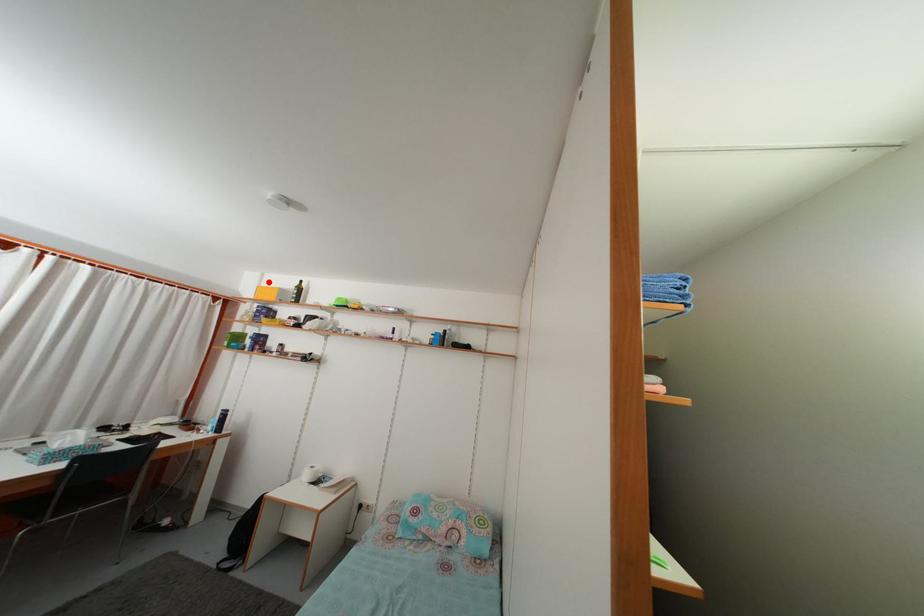
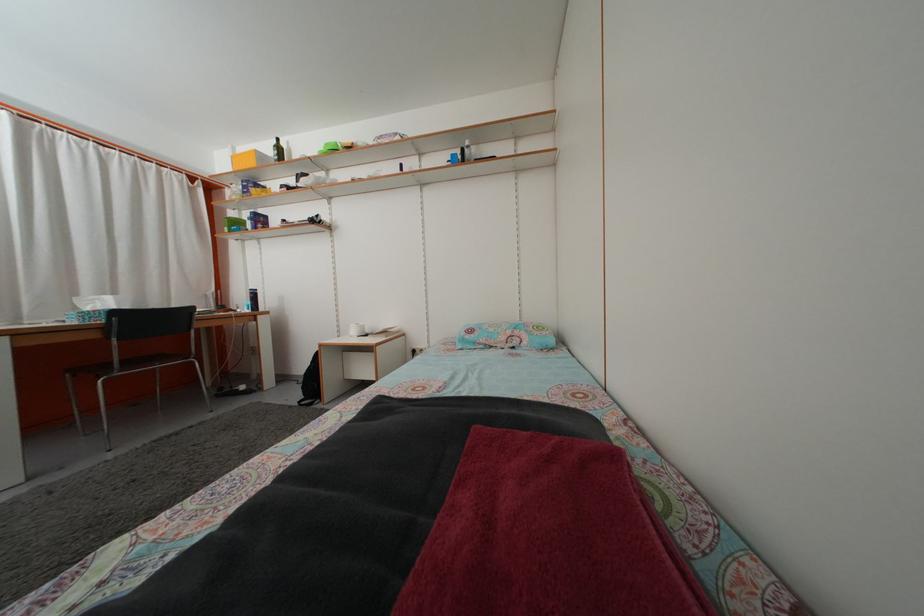
Question: A red point is marked in image1. In image2, is the corresponding 3D point closer to the camera or farther? Reply with the corresponding letter.

Choices:
 (A) The corresponding 3D point is closer.
 (B) The corresponding 3D point is farther.

Answer: (A)